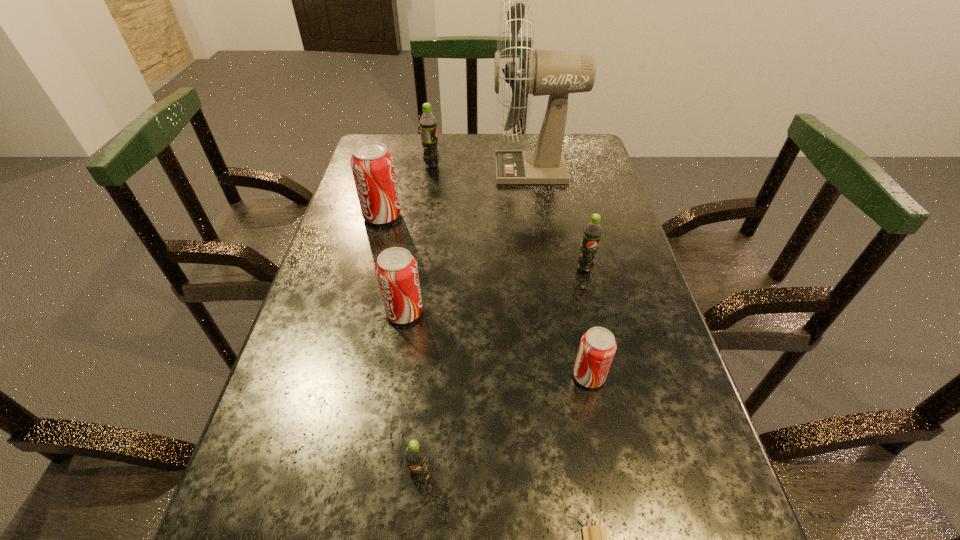
Identify the location of the third nearest object. The height and width of the screenshot is (540, 960). pos(597,348).

Where is `the rightmost red soda can`? the rightmost red soda can is located at coordinates (597, 348).

Identify the location of the fourth soda from left to right. (415, 454).

Image resolution: width=960 pixels, height=540 pixels. I want to click on the nearest soda, so click(415, 454).

Locate an element on the screen. The width and height of the screenshot is (960, 540). blank area located on the air flow direction of the gray fan is located at coordinates (427, 170).

The image size is (960, 540). Find the location of `vacant area situated on the air flow direction of the gray fan`. vacant area situated on the air flow direction of the gray fan is located at coordinates (388, 170).

Locate an element on the screen. vacant space positioned on the air flow direction of the gray fan is located at coordinates (427, 170).

Image resolution: width=960 pixels, height=540 pixels. I want to click on vacant space located on the logo side of the leftmost red soda can, so click(454, 216).

Locate an element on the screen. free space located 0.370m on the front label of the leftmost green soda is located at coordinates (561, 166).

Identify the location of free space located 0.100m on the logo side of the second red soda can from right to left. (470, 312).